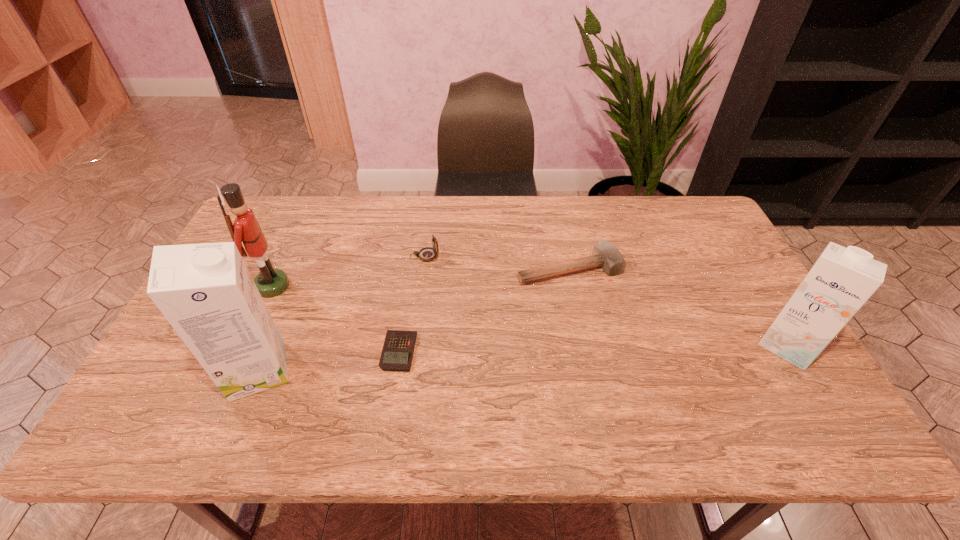
At what (x,y) coordinates should I click in order to perform the action: click on free spot that satisfies the following two spatial constraints: 1. on the front-facing side of the nutcracker; 2. on the back side of the shorter carton. Please return your answer as a coordinate pair (x, y). This screenshot has height=540, width=960. Looking at the image, I should click on (246, 345).

This screenshot has height=540, width=960. What are the coordinates of `vacant space that satisfies the following two spatial constraints: 1. on the front-facing side of the nutcracker; 2. on the right side of the calculator` in the screenshot? It's located at (242, 352).

This screenshot has width=960, height=540. What are the coordinates of `free location that satisfies the following two spatial constraints: 1. on the front-facing side of the shortest object; 2. on the left side of the nutcracker` in the screenshot? It's located at (242, 352).